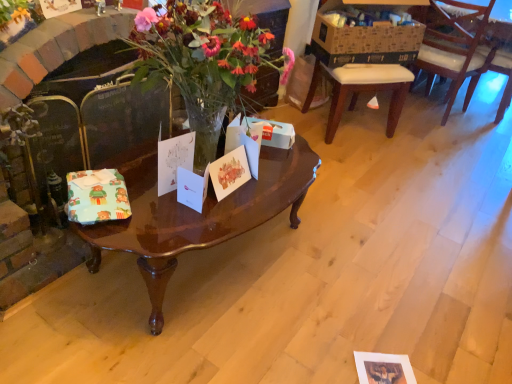
Find the location of a particular element. This screenshot has height=384, width=512. free space between brightly colored paper at center, positioned as the fourth gift card in right-to-left order, and white paper gift card at center, arranged as the third gift card when viewed from the left is located at coordinates (147, 202).